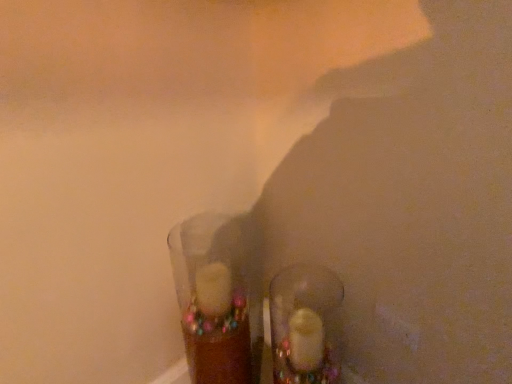
Identify the location of translucent glass candle at center. (215, 298).

What do you see at coordinates (215, 298) in the screenshot? This screenshot has width=512, height=384. I see `translucent glass candle at center` at bounding box center [215, 298].

Image resolution: width=512 pixels, height=384 pixels. What do you see at coordinates (305, 324) in the screenshot?
I see `translucent glass shoe at center` at bounding box center [305, 324].

What is the approximate height of translucent glass shoe at center?

The height of translucent glass shoe at center is 24.55 inches.

Identify the location of translucent glass shoe at center. (305, 324).

Where is `translucent glass candle at center`? translucent glass candle at center is located at coordinates (215, 298).

Is translucent glass shoe at center at the right side of translucent glass candle at center?

Yes, translucent glass shoe at center is to the right of translucent glass candle at center.

Considering their positions, is translucent glass shoe at center located in front of or behind translucent glass candle at center?

In the image, translucent glass shoe at center appears behind translucent glass candle at center.

From the picture: Which is closer to the camera, [297,268] or [238,257]?

Point [297,268] appears to be closer to the viewer than point [238,257].

From the image's perspective, is translucent glass shoe at center located above translucent glass candle at center?

No, from the image's perspective, translucent glass shoe at center is not on top of translucent glass candle at center.

From the picture: From a real-world perspective, does translucent glass shoe at center stand above translucent glass candle at center?

No, from a real-world perspective, translucent glass shoe at center is not over translucent glass candle at center

Considering the sizes of objects translucent glass shoe at center and translucent glass candle at center in the image provided, who is wider, translucent glass shoe at center or translucent glass candle at center?

Wider between the two is translucent glass candle at center.

Does translucent glass shoe at center have a lesser height compared to translucent glass candle at center?

Indeed, translucent glass shoe at center has a lesser height compared to translucent glass candle at center.

Consider the image. Between translucent glass shoe at center and translucent glass candle at center, which one has larger size?

translucent glass candle at center is bigger.

Is translucent glass shoe at center inside the boundaries of translucent glass candle at center, or outside?

translucent glass shoe at center is not enclosed by translucent glass candle at center.

Would you say translucent glass shoe at center is a long distance from translucent glass candle at center?

They are positioned close to each other.

Could you tell me if translucent glass shoe at center is turned towards translucent glass candle at center?

No, translucent glass shoe at center is not aimed at translucent glass candle at center.

What's the angular difference between translucent glass shoe at center and translucent glass candle at center's facing directions?

The facing directions of translucent glass shoe at center and translucent glass candle at center are 4.37 degrees apart.

The width and height of the screenshot is (512, 384). I want to click on shot glass above the translucent glass shoe at center (from the image's perspective), so click(215, 298).

Considering the relative positions of translucent glass candle at center and translucent glass shoe at center in the image provided, is translucent glass candle at center to the right of translucent glass shoe at center from the viewer's perspective?

No.

Is translucent glass candle at center closer to the viewer compared to translucent glass shoe at center?

Yes, the depth of translucent glass candle at center is less than that of translucent glass shoe at center.

Is point (204, 249) closer or farther from the camera than point (305, 380)?

Point (204, 249) is positioned farther from the camera compared to point (305, 380).

From the image's perspective, who appears lower, translucent glass candle at center or translucent glass shoe at center?

translucent glass shoe at center appears lower in the image.

From a real-world perspective, who is located lower, translucent glass candle at center or translucent glass shoe at center?

translucent glass shoe at center is physically lower.

Considering the sizes of objects translucent glass candle at center and translucent glass shoe at center in the image provided, who is thinner, translucent glass candle at center or translucent glass shoe at center?

translucent glass shoe at center is thinner.

From their relative heights in the image, would you say translucent glass candle at center is taller or shorter than translucent glass shoe at center?

translucent glass candle at center is taller than translucent glass shoe at center.

Based on the photo, is translucent glass candle at center smaller than translucent glass shoe at center?

No.

Is translucent glass candle at center not within translucent glass shoe at center?

Answer: Yes, translucent glass candle at center is not within translucent glass shoe at center.

Is translucent glass candle at center far away from translucent glass shoe at center?

They are positioned close to each other.

Is translucent glass candle at center facing towards translucent glass shoe at center?

No, translucent glass candle at center is not turned towards translucent glass shoe at center.

Locate an element on the screen. This screenshot has height=384, width=512. shot glass that is above the translucent glass shoe at center (from the image's perspective) is located at coordinates (215, 298).

The image size is (512, 384). Find the location of `footwear located underneath the translucent glass candle at center (from a real-world perspective)`. footwear located underneath the translucent glass candle at center (from a real-world perspective) is located at coordinates (305, 324).

Identify the location of shot glass located in front of the translucent glass shoe at center. (215, 298).